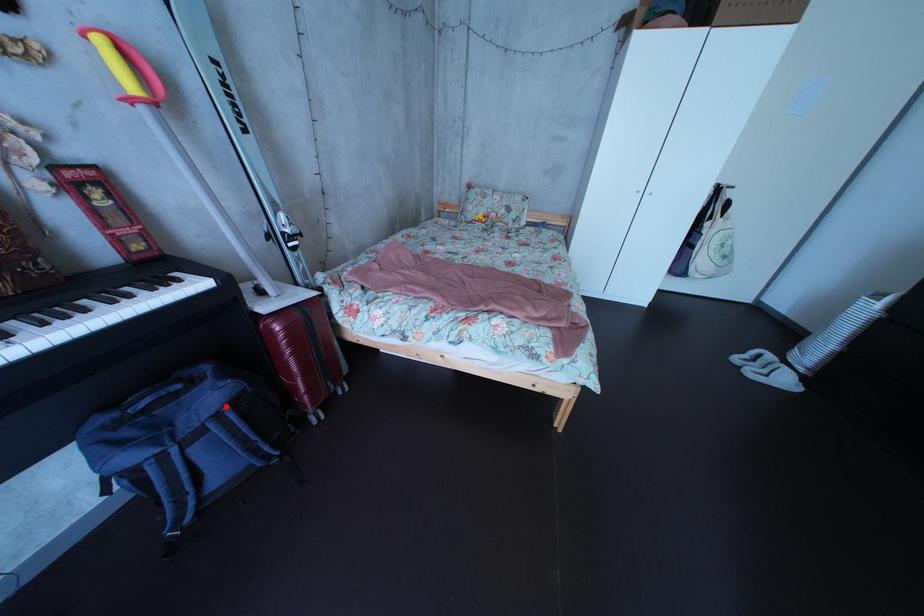
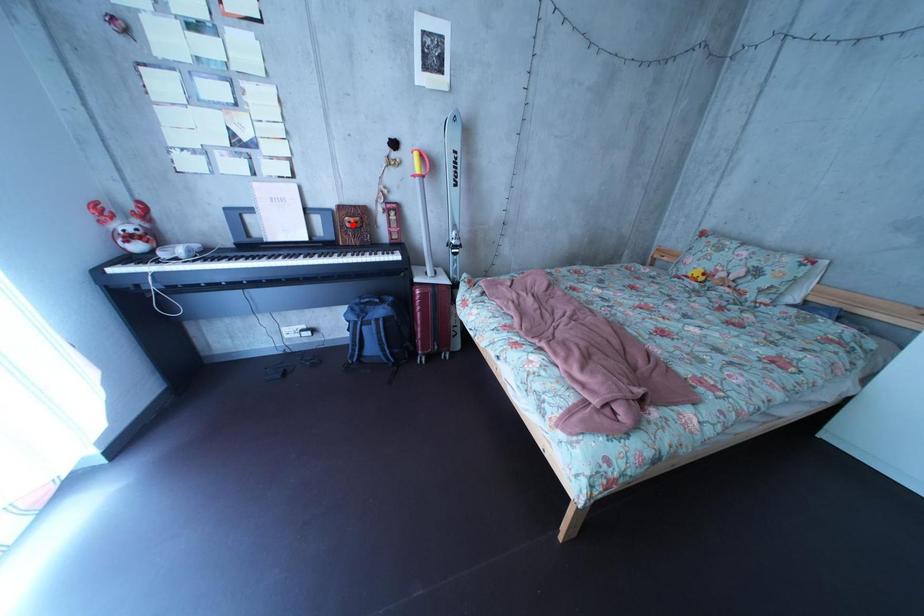
I am providing you with two images of the same scene from different viewpoints. A red point is marked on the first image and another point is marked on the second image. Is the red point in image1 aligned with the point shown in image2?

No